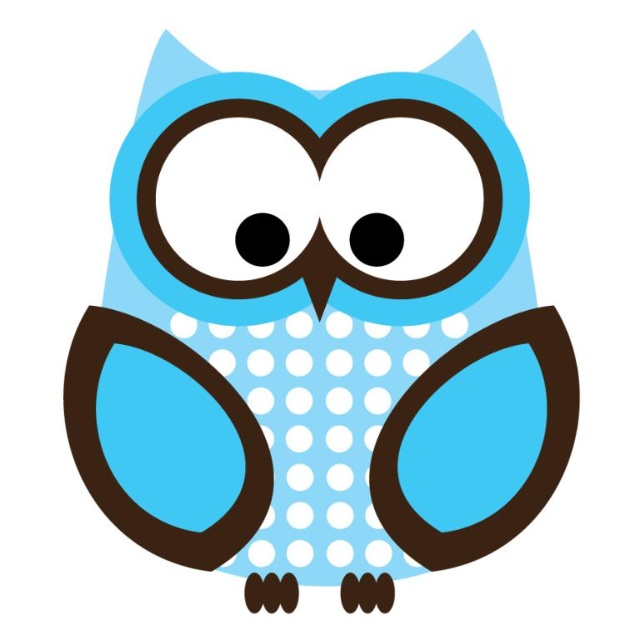
Question: Is matte blue polka dot owl at center thinner than black matte circle at center?

Choices:
 (A) no
 (B) yes

Answer: (A)

Question: Does matte blue polka dot owl at center have a greater width compared to black glossy eye at center?

Choices:
 (A) no
 (B) yes

Answer: (B)

Question: Does matte blue polka dot owl at center lie behind black glossy eye at center?

Choices:
 (A) yes
 (B) no

Answer: (B)

Question: Among these objects, which one is nearest to the camera?

Choices:
 (A) black matte circle at center
 (B) black glossy eye at center
 (C) matte blue polka dot owl at center

Answer: (C)

Question: Which of the following is the closest to the observer?

Choices:
 (A) (260, 257)
 (B) (186, 372)
 (C) (365, 257)

Answer: (B)

Question: Which point is farther to the camera?

Choices:
 (A) (378, 221)
 (B) (250, 250)

Answer: (A)